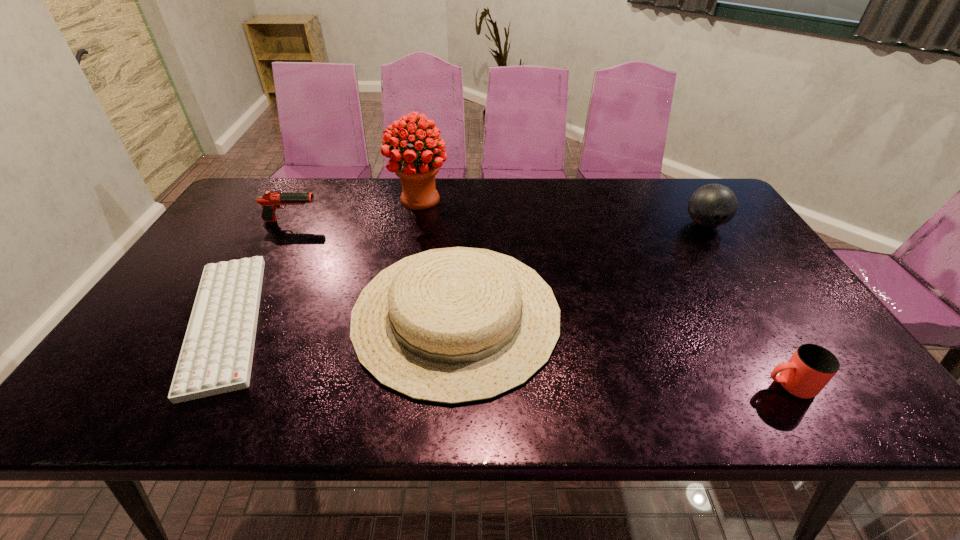
In the image, there is a desktop. Find the location of `vacant space at the far right corner`. vacant space at the far right corner is located at coordinates (674, 185).

Where is `free space between the sunhat and the shortest object`? free space between the sunhat and the shortest object is located at coordinates (341, 318).

This screenshot has height=540, width=960. I want to click on vacant area that lies between the tallest object and the computer keyboard, so click(323, 260).

Identify the location of free point between the bouquet and the second tallest object. The height and width of the screenshot is (540, 960). (563, 212).

Locate an element on the screen. This screenshot has height=540, width=960. vacant area that lies between the cup and the bowling ball is located at coordinates (747, 305).

Locate an element on the screen. This screenshot has width=960, height=540. free space between the gun and the bowling ball is located at coordinates (498, 222).

Locate an element on the screen. The height and width of the screenshot is (540, 960). free space between the cup and the fifth shortest object is located at coordinates (747, 305).

Locate an element on the screen. vacant area that lies between the bowling ball and the gun is located at coordinates (498, 222).

Locate an element on the screen. This screenshot has height=540, width=960. free space between the fifth shortest object and the tallest object is located at coordinates (563, 212).

Identify the location of object that ranks as the closest to the cup. This screenshot has height=540, width=960. (454, 325).